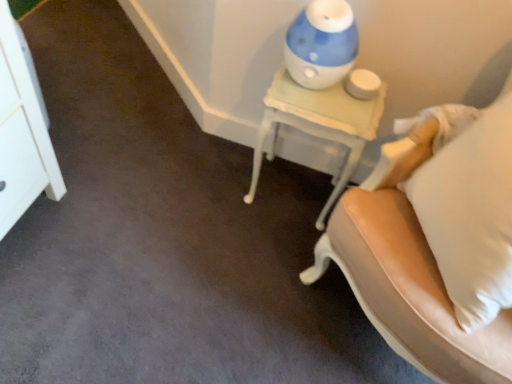
Locate an element on the screen. Image resolution: width=512 pixels, height=384 pixels. free space to the back side of white glossy dresser at upper left is located at coordinates (60, 89).